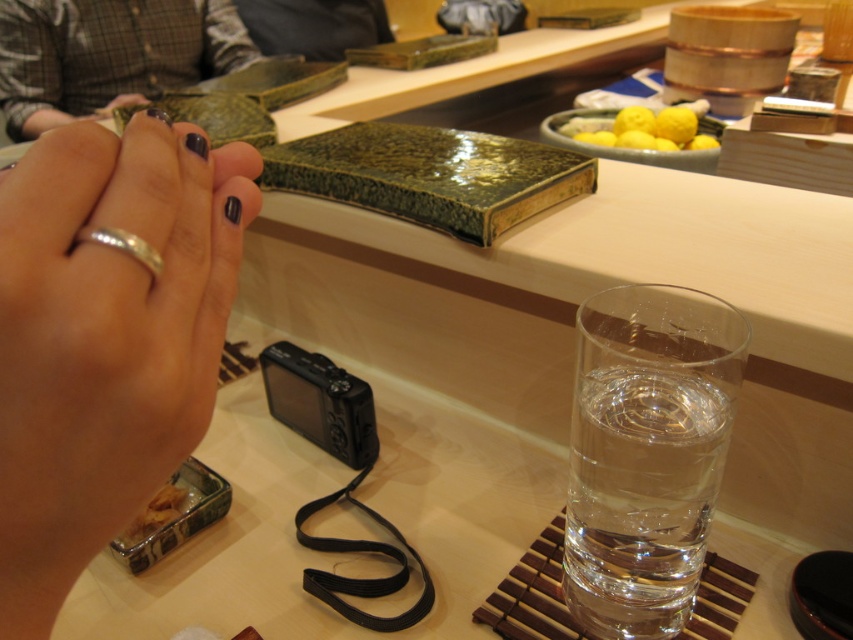
Which is above, silver metallic ring at lower left or clear glass water at right?

silver metallic ring at lower left is higher up.

Is point (219, 276) positioned after point (717, 420)?

No, (219, 276) is closer to viewer.

The image size is (853, 640). What are the coordinates of `silver metallic ring at lower left` in the screenshot? It's located at (109, 324).

Which is behind, point (657, 147) or point (138, 102)?

Point (657, 147)

Is point (677, 145) positioned after point (119, 100)?

No, it is in front of (119, 100).

This screenshot has width=853, height=640. What are the coordinates of `yellow matte lemons at upper center` in the screenshot? It's located at (643, 129).

Is clear glass water at right taller than nail polish at center?

In fact, clear glass water at right may be shorter than nail polish at center.

Between clear glass water at right and nail polish at center, which one has less height?

clear glass water at right

Is point (641, 513) closer to camera compared to point (107, 104)?

Yes, it is in front of point (107, 104).

This screenshot has width=853, height=640. In order to click on clear glass water at right in this screenshot , I will do `click(640, 496)`.